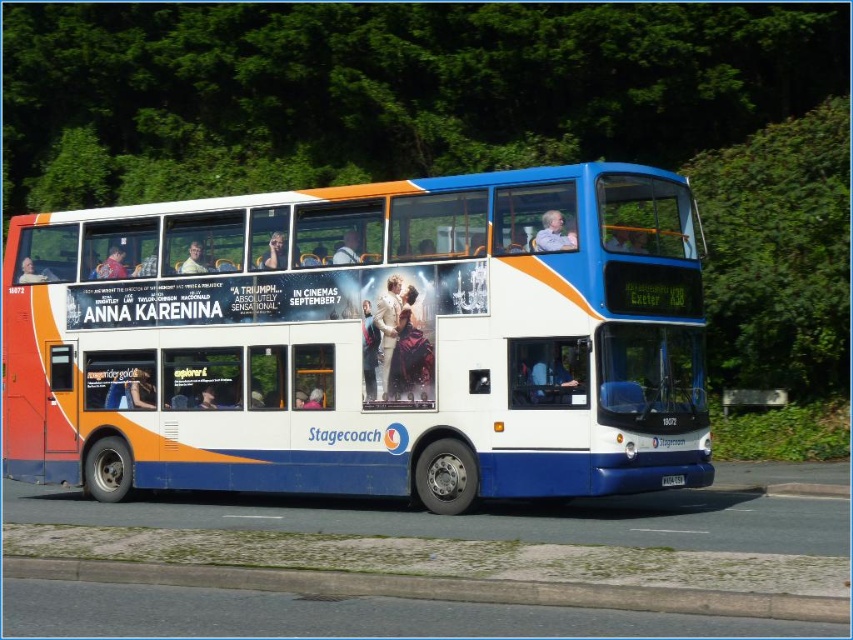
How much distance is there between white glossy bus at center and white plastic license plate at center?

white glossy bus at center and white plastic license plate at center are 3.97 meters apart.

Does white glossy bus at center appear over white plastic license plate at center?

Yes.

You are a GUI agent. You are given a task and a screenshot of the screen. Output one action in this format:
    pyautogui.click(x=<x>, y=<y>)
    Task: Click on the white glossy bus at center
    This screenshot has height=640, width=853.
    Given the screenshot: What is the action you would take?
    pos(364,340)

Where is `white glossy bus at center`? This screenshot has height=640, width=853. white glossy bus at center is located at coordinates (364, 340).

Is white glossy bus at center below gray concrete curb at lower center?

No.

Where is `white glossy bus at center`? Image resolution: width=853 pixels, height=640 pixels. white glossy bus at center is located at coordinates (364, 340).

Locate an element on the screen. This screenshot has width=853, height=640. white glossy bus at center is located at coordinates (364, 340).

Is gray concrete curb at lower center above white plastic license plate at center?

Actually, gray concrete curb at lower center is below white plastic license plate at center.

Find the location of a particular element. The height and width of the screenshot is (640, 853). gray concrete curb at lower center is located at coordinates (440, 588).